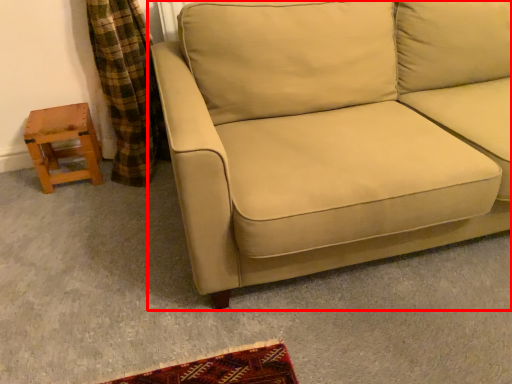
Question: From the image's perspective, where is studio couch (annotated by the red box) located relative to stool?

Choices:
 (A) below
 (B) above

Answer: (B)